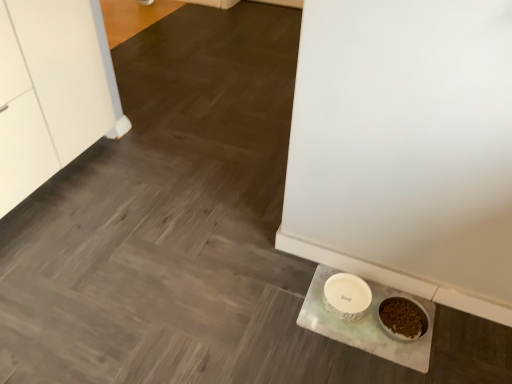
Locate an element on the screen. This screenshot has height=384, width=512. vacant space underneath white speckled ceramic bowl at lower right (from a real-world perspective) is located at coordinates (351, 296).